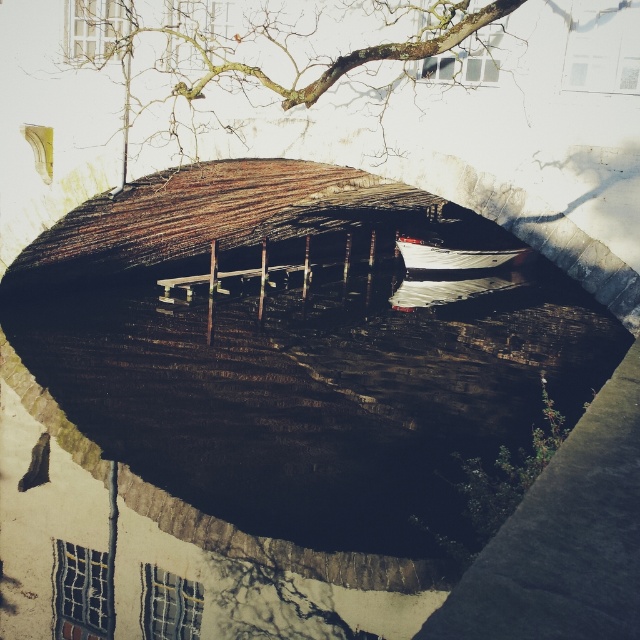
Question: Can you confirm if bare branches at upper center is bigger than white glossy boat at center?

Choices:
 (A) no
 (B) yes

Answer: (B)

Question: Can you confirm if bare branches at upper center is positioned to the right of white glossy boat at center?

Choices:
 (A) no
 (B) yes

Answer: (A)

Question: Is bare branches at upper center to the left of white glossy boat at center from the viewer's perspective?

Choices:
 (A) yes
 (B) no

Answer: (A)